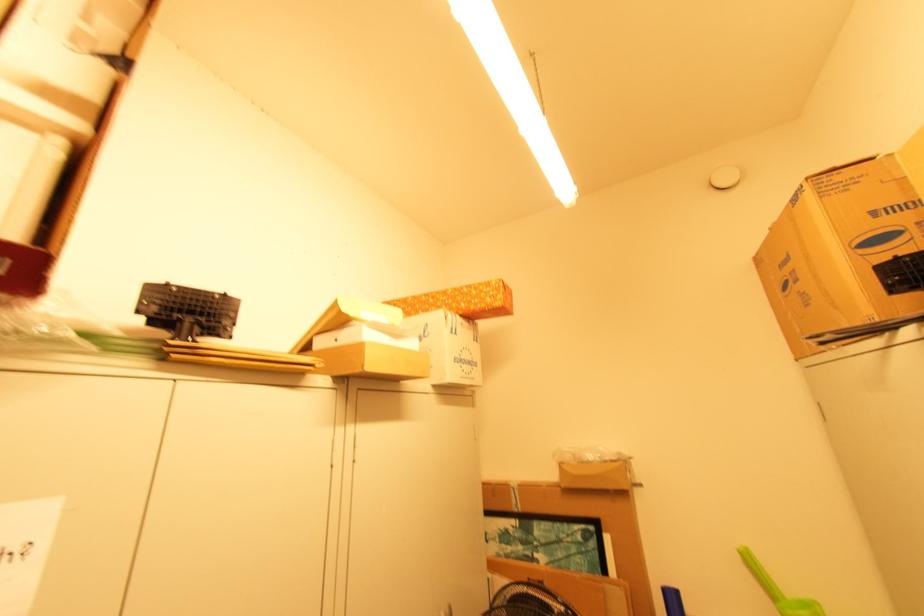
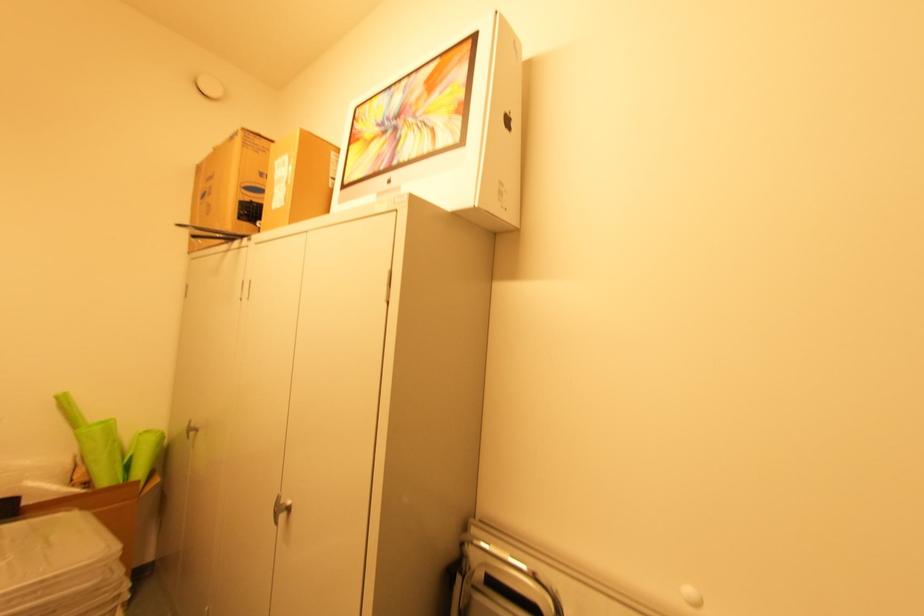
Locate, in the second image, the point that corresponds to (x=772, y=229) in the first image.

(216, 148)